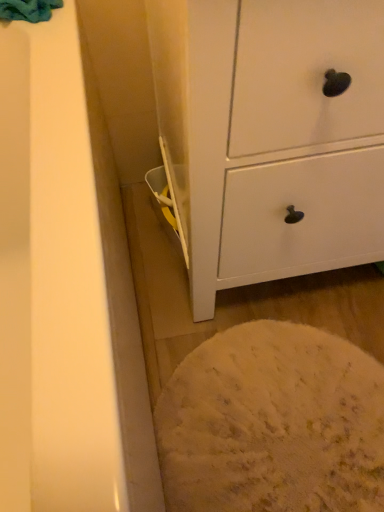
Image resolution: width=384 pixels, height=512 pixels. Describe the element at coordinates (28, 10) in the screenshot. I see `teal soft towel at upper left` at that location.

Measure the distance between teal soft towel at upper left and camera.

A distance of 28.02 inches exists between teal soft towel at upper left and camera.

Where is `teal soft towel at upper left`? This screenshot has width=384, height=512. teal soft towel at upper left is located at coordinates pyautogui.click(x=28, y=10).

What is the approximate width of white matte chest of drawers at center?

20.00 inches.

This screenshot has height=512, width=384. Describe the element at coordinates (271, 136) in the screenshot. I see `white matte chest of drawers at center` at that location.

Measure the distance between white matte chest of drawers at center and camera.

A distance of 14.91 inches exists between white matte chest of drawers at center and camera.

The width and height of the screenshot is (384, 512). In order to click on white matte chest of drawers at center in this screenshot , I will do `click(271, 136)`.

This screenshot has height=512, width=384. I want to click on teal soft towel at upper left, so click(28, 10).

Which object is positioned more to the right, teal soft towel at upper left or white matte chest of drawers at center?

Positioned to the right is white matte chest of drawers at center.

Is teal soft towel at upper left in front of or behind white matte chest of drawers at center in the image?

Visually, teal soft towel at upper left is located behind white matte chest of drawers at center.

Considering the positions of point (0, 8) and point (246, 115), is point (0, 8) closer or farther from the camera than point (246, 115)?

Point (0, 8) is farther from the camera than point (246, 115).

From the image's perspective, relative to white matte chest of drawers at center, is teal soft towel at upper left above or below?

Clearly, from the image's perspective, teal soft towel at upper left is above white matte chest of drawers at center.

From a real-world perspective, is teal soft towel at upper left physically located above or below white matte chest of drawers at center?

teal soft towel at upper left is above white matte chest of drawers at center.

Between teal soft towel at upper left and white matte chest of drawers at center, which one has larger width?

With larger width is white matte chest of drawers at center.

Can you confirm if teal soft towel at upper left is taller than white matte chest of drawers at center?

Incorrect, the height of teal soft towel at upper left is not larger of that of white matte chest of drawers at center.

Based on the photo, is teal soft towel at upper left smaller than white matte chest of drawers at center?

Yes.

Is teal soft towel at upper left inside the boundaries of white matte chest of drawers at center, or outside?

The correct answer is: outside.

Is teal soft towel at upper left not close to white matte chest of drawers at center?

No, teal soft towel at upper left is in close proximity to white matte chest of drawers at center.

Is white matte chest of drawers at center at the back of teal soft towel at upper left?

teal soft towel at upper left does not have its back to white matte chest of drawers at center.

How different are the orientations of teal soft towel at upper left and white matte chest of drawers at center in degrees?

teal soft towel at upper left and white matte chest of drawers at center are facing 1.53 degrees away from each other.

How much distance is there between teal soft towel at upper left and white matte chest of drawers at center?

They are 19.33 inches apart.

The height and width of the screenshot is (512, 384). Identify the location of chest of drawers lying on the right of teal soft towel at upper left. (271, 136).

Which is more to the right, white matte chest of drawers at center or teal soft towel at upper left?

white matte chest of drawers at center.

Relative to teal soft towel at upper left, is white matte chest of drawers at center in front or behind?

white matte chest of drawers at center is positioned closer to the viewer than teal soft towel at upper left.

Is point (278, 124) positioned after point (10, 19)?

No, (278, 124) is in front of (10, 19).

From the image's perspective, is white matte chest of drawers at center over teal soft towel at upper left?

Incorrect, from the image's perspective, white matte chest of drawers at center is lower than teal soft towel at upper left.

From a real-world perspective, which object rests below the other?

From a 3D spatial view, white matte chest of drawers at center is below.

Which object is thinner, white matte chest of drawers at center or teal soft towel at upper left?

With smaller width is teal soft towel at upper left.

Based on the photo, between white matte chest of drawers at center and teal soft towel at upper left, which one has less height?

With less height is teal soft towel at upper left.

Consider the image. Is white matte chest of drawers at center smaller than teal soft towel at upper left?

No, white matte chest of drawers at center is not smaller than teal soft towel at upper left.

Would you say white matte chest of drawers at center is inside or outside teal soft towel at upper left?

white matte chest of drawers at center is located beyond the bounds of teal soft towel at upper left.

Does white matte chest of drawers at center touch teal soft towel at upper left?

No, white matte chest of drawers at center is not in contact with teal soft towel at upper left.

Is teal soft towel at upper left at the back of white matte chest of drawers at center?

No, white matte chest of drawers at center is not facing away from teal soft towel at upper left.

Based on the photo, can you tell me how much white matte chest of drawers at center and teal soft towel at upper left differ in facing direction?

white matte chest of drawers at center and teal soft towel at upper left are facing 1.53 degrees away from each other.

How distant is white matte chest of drawers at center from teal soft towel at upper left?

19.33 inches.

Image resolution: width=384 pixels, height=512 pixels. What are the coordinates of `chest of drawers in front of the teal soft towel at upper left` in the screenshot? It's located at (271, 136).

Locate an element on the screen. The image size is (384, 512). the chest of drawers below the teal soft towel at upper left (from a real-world perspective) is located at coordinates (271, 136).

The image size is (384, 512). In order to click on bath towel located above the white matte chest of drawers at center (from a real-world perspective) in this screenshot , I will do `click(28, 10)`.